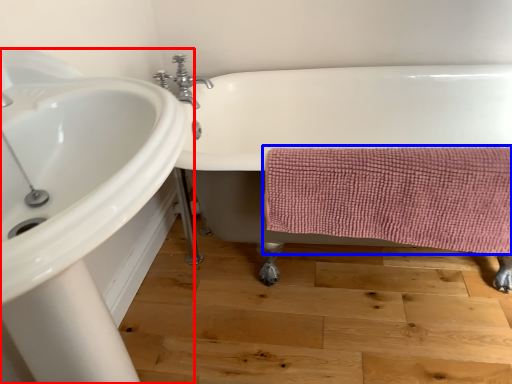
Question: Among these objects, which one is nearest to the camera, sink (highlighted by a red box) or bath towel (highlighted by a blue box)?

Choices:
 (A) sink
 (B) bath towel

Answer: (A)